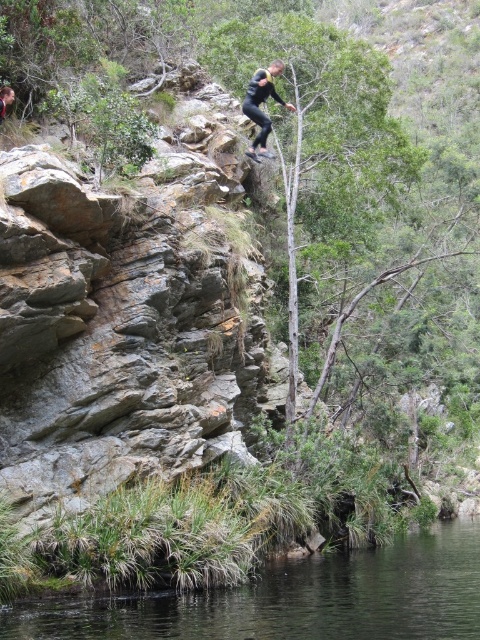
You are a safety inspector assessing the scene. The clear water at lower center and the black matte clothing at upper center are both critical to evaluate. Which object is bigger in size?

The clear water at lower center has a larger size compared to the black matte clothing at upper center.

You are a photographer positioned at the cliff edge. You want to capture the black matte clothing at center and the clear water at lower center in your shot. Which object should you adjust your camera to focus on first if you want to ensure both are in frame and properly aligned according to their positions?

The black matte clothing at center should be focused on first since the clear water at lower center is positioned to the right of it. By centering the black matte clothing at center, you can then adjust the camera to include the clear water at lower center to its right, ensuring proper alignment.